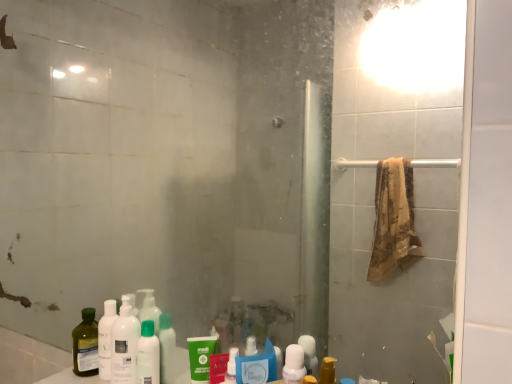
Where is `white matte bottle at lower left`? The height and width of the screenshot is (384, 512). white matte bottle at lower left is located at coordinates [124, 344].

This screenshot has width=512, height=384. What do you see at coordinates (201, 357) in the screenshot? I see `green matte tube at lower center, which ranks as the 2th mouthwash in front-to-back order` at bounding box center [201, 357].

In order to face green matte tube at lower center, the first mouthwash from the left, should I rotate leftwards or rightwards?

It's best to rotate left around 7.096 degrees.

Describe the element at coordinates (148, 355) in the screenshot. I see `green matte bottle at center` at that location.

Measure the distance between point (290, 383) and camera.

Point (290, 383) and camera are 29.96 inches apart from each other.

Find the location of a particular element. white matte bottle at lower left is located at coordinates (124, 344).

Between green matte bottle at center and white plastic bottle at lower center, marked as the 1th mouthwash in a right-to-left arrangement, which one appears on the left side from the viewer's perspective?

From the viewer's perspective, green matte bottle at center appears more on the left side.

Which is behind, green matte bottle at center or white plastic bottle at lower center, marked as the second mouthwash in a back-to-front arrangement?

green matte bottle at center is further from the camera.

Would you say white plastic bottle at lower center, which appears as the second mouthwash when viewed from the left, is part of green matte bottle at center's contents?

That's incorrect, white plastic bottle at lower center, which appears as the second mouthwash when viewed from the left, is not inside green matte bottle at center.

Locate an element on the screen. This screenshot has height=384, width=512. cleaning product located behind the white plastic bottle at lower center, marked as the second mouthwash in a back-to-front arrangement is located at coordinates (124, 344).

How many degrees apart are the facing directions of white plastic bottle at lower center, marked as the second mouthwash in a back-to-front arrangement, and white matte bottle at lower left?

The facing directions of white plastic bottle at lower center, marked as the second mouthwash in a back-to-front arrangement, and white matte bottle at lower left are 0.00187 degrees apart.

From the image's perspective, would you say white plastic bottle at lower center, the 1th mouthwash from the front, is shown under white matte bottle at lower left?

Correct, white plastic bottle at lower center, the 1th mouthwash from the front, appears lower than white matte bottle at lower left in the image.

In terms of height, does white plastic bottle at lower center, the 1th mouthwash from the front, look taller or shorter compared to white matte bottle at lower left?

In the image, white plastic bottle at lower center, the 1th mouthwash from the front, appears to be shorter than white matte bottle at lower left.

Considering the relative sizes of green matte tube at lower center, the first mouthwash from the left, and green matte bottle at center in the image provided, is green matte tube at lower center, the first mouthwash from the left, wider than green matte bottle at center?

Correct, the width of green matte tube at lower center, the first mouthwash from the left, exceeds that of green matte bottle at center.

From a real-world perspective, between green matte tube at lower center, the first mouthwash from the back, and green matte bottle at center, who is vertically higher?

green matte bottle at center, from a real-world perspective.

Is green matte tube at lower center, which ranks as the 2th mouthwash in front-to-back order, facing away from green matte bottle at center?

No, green matte tube at lower center, which ranks as the 2th mouthwash in front-to-back order, is not facing the opposite direction of green matte bottle at center.

Is green matte tube at lower center, which is the 2th mouthwash in right-to-left order, to the left of green matte bottle at center from the viewer's perspective?

No.

Is white plastic bottle at lower center, which appears as the second mouthwash when viewed from the left, taller than green matte tube at lower center, which ranks as the 2th mouthwash in front-to-back order?

Yes, white plastic bottle at lower center, which appears as the second mouthwash when viewed from the left, is taller than green matte tube at lower center, which ranks as the 2th mouthwash in front-to-back order.

Considering the points (288, 371) and (192, 377), which point is behind, point (288, 371) or point (192, 377)?

The point (192, 377) is more distant.

Does white plastic bottle at lower center, marked as the second mouthwash in a back-to-front arrangement, touch green matte tube at lower center, the first mouthwash from the back?

white plastic bottle at lower center, marked as the second mouthwash in a back-to-front arrangement, and green matte tube at lower center, the first mouthwash from the back, are not in contact.

Would you say white plastic bottle at lower center, the 1th mouthwash from the front, is inside or outside green matte tube at lower center, the first mouthwash from the back?

white plastic bottle at lower center, the 1th mouthwash from the front, is spatially situated outside green matte tube at lower center, the first mouthwash from the back.

Can you confirm if white matte bottle at lower left is shorter than green matte tube at lower center, which ranks as the 2th mouthwash in front-to-back order?

No, white matte bottle at lower left is not shorter than green matte tube at lower center, which ranks as the 2th mouthwash in front-to-back order.

From the image's perspective, between white matte bottle at lower left and green matte tube at lower center, which is the 2th mouthwash in right-to-left order, which one is located above?

white matte bottle at lower left appears higher in the image.

Is white matte bottle at lower left bigger than green matte tube at lower center, the first mouthwash from the left?

Yes.

Is white matte bottle at lower left positioned before green matte tube at lower center, which is the 2th mouthwash in right-to-left order?

No, it is behind green matte tube at lower center, which is the 2th mouthwash in right-to-left order.

Considering the sizes of objects green matte bottle at center and white matte bottle at lower left in the image provided, who is wider, green matte bottle at center or white matte bottle at lower left?

Wider between the two is white matte bottle at lower left.

Would you say green matte bottle at center contains white matte bottle at lower left?

No, white matte bottle at lower left is not a part of green matte bottle at center.

Between green matte bottle at center and white matte bottle at lower left, which one appears on the left side from the viewer's perspective?

white matte bottle at lower left is more to the left.

Which of these two, green matte bottle at center or white matte bottle at lower left, stands taller?

white matte bottle at lower left.

From a real-world perspective, between green matte tube at lower center, the first mouthwash from the left, and white plastic bottle at lower center, marked as the second mouthwash in a back-to-front arrangement, who is vertically higher?

white plastic bottle at lower center, marked as the second mouthwash in a back-to-front arrangement.

How different are the orientations of green matte tube at lower center, which is the 2th mouthwash in right-to-left order, and white plastic bottle at lower center, marked as the second mouthwash in a back-to-front arrangement, in degrees?

0.00244 degrees.

Which is correct: green matte tube at lower center, the first mouthwash from the back, is inside white plastic bottle at lower center, marked as the 1th mouthwash in a right-to-left arrangement, or outside of it?

green matte tube at lower center, the first mouthwash from the back, is outside white plastic bottle at lower center, marked as the 1th mouthwash in a right-to-left arrangement.

Does green matte tube at lower center, the first mouthwash from the left, have a larger size compared to white plastic bottle at lower center, the 1th mouthwash from the front?

Correct, green matte tube at lower center, the first mouthwash from the left, is larger in size than white plastic bottle at lower center, the 1th mouthwash from the front.

Locate an element on the screen. The width and height of the screenshot is (512, 384). mouthwash that is the 2nd object located in front of the green matte bottle at center is located at coordinates (294, 365).

In order to click on cleaning product that appears above the white plastic bottle at lower center, marked as the 1th mouthwash in a right-to-left arrangement (from the image's perspective) in this screenshot , I will do `click(124, 344)`.

Looking at this image, which object lies further to the anchor point white matte bottle at lower left, green matte bottle at center or white plastic bottle at lower center, which appears as the second mouthwash when viewed from the left?

white plastic bottle at lower center, which appears as the second mouthwash when viewed from the left.

When comparing their distances from green matte tube at lower center, which ranks as the 2th mouthwash in front-to-back order, does white plastic bottle at lower center, which appears as the second mouthwash when viewed from the left, or white matte bottle at lower left seem closer?

white matte bottle at lower left is positioned closer to the anchor green matte tube at lower center, which ranks as the 2th mouthwash in front-to-back order.

Looking at the image, which one is located closer to white matte bottle at lower left, green matte tube at lower center, which ranks as the 2th mouthwash in front-to-back order, or white plastic bottle at lower center, the 1th mouthwash from the front?

The object closer to white matte bottle at lower left is green matte tube at lower center, which ranks as the 2th mouthwash in front-to-back order.

When comparing their distances from green matte tube at lower center, which ranks as the 2th mouthwash in front-to-back order, does white matte bottle at lower left or green matte bottle at center seem further?

Based on the image, white matte bottle at lower left appears to be further to green matte tube at lower center, which ranks as the 2th mouthwash in front-to-back order.

When comparing their distances from white plastic bottle at lower center, marked as the 1th mouthwash in a right-to-left arrangement, does green matte tube at lower center, the first mouthwash from the left, or green matte bottle at center seem further?

Among the two, green matte bottle at center is located further to white plastic bottle at lower center, marked as the 1th mouthwash in a right-to-left arrangement.

Which object lies further to the anchor point white matte bottle at lower left, green matte tube at lower center, which ranks as the 2th mouthwash in front-to-back order, or green matte bottle at center?

green matte tube at lower center, which ranks as the 2th mouthwash in front-to-back order.

Considering their positions, is white plastic bottle at lower center, which appears as the second mouthwash when viewed from the left, positioned closer to white matte bottle at lower left than green matte tube at lower center, which is the 2th mouthwash in right-to-left order?

green matte tube at lower center, which is the 2th mouthwash in right-to-left order.

When comparing their distances from green matte bottle at center, does white plastic bottle at lower center, marked as the second mouthwash in a back-to-front arrangement, or green matte tube at lower center, which is the 2th mouthwash in right-to-left order, seem further?

white plastic bottle at lower center, marked as the second mouthwash in a back-to-front arrangement.

The height and width of the screenshot is (384, 512). In order to click on toiletry located between white matte bottle at lower left and green matte tube at lower center, the first mouthwash from the left, in the left-right direction in this screenshot , I will do `click(148, 355)`.

This screenshot has height=384, width=512. What are the coordinates of `mouthwash between white matte bottle at lower left and white plastic bottle at lower center, marked as the 1th mouthwash in a right-to-left arrangement` in the screenshot? It's located at (201, 357).

This screenshot has width=512, height=384. I want to click on mouthwash situated between green matte bottle at center and white plastic bottle at lower center, marked as the 1th mouthwash in a right-to-left arrangement, from left to right, so click(201, 357).

The image size is (512, 384). Identify the location of toiletry located between white matte bottle at lower left and white plastic bottle at lower center, which appears as the second mouthwash when viewed from the left, in the left-right direction. (148, 355).